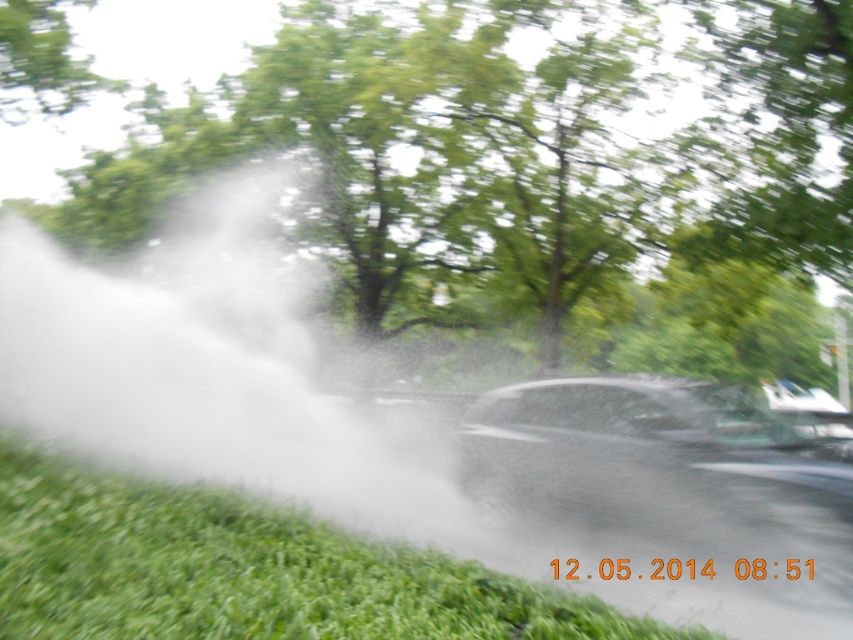
You are driving a car and see the image. There is a white mist at center and a shiny black car at center. Which object is higher in the image?

The white mist at center is taller than the shiny black car at center.

You are driving a car and see the image. There is white mist at center and a shiny black car at center in front of you. Which object is closer to the left side of your view?

Result: The white mist at center is to the left of the shiny black car at center, so the white mist at center is closer to the left side of your view.

You are a photographer trying to capture a clear shot of the green grass at lower left without the white mist at center obstructing it. Based on the scene, can you adjust your camera angle to avoid the mist?

The white mist at center is larger in size than green grass at lower left, so adjusting the camera angle downward might help to focus on the smaller green grass at lower left while avoiding the larger white mist at center.